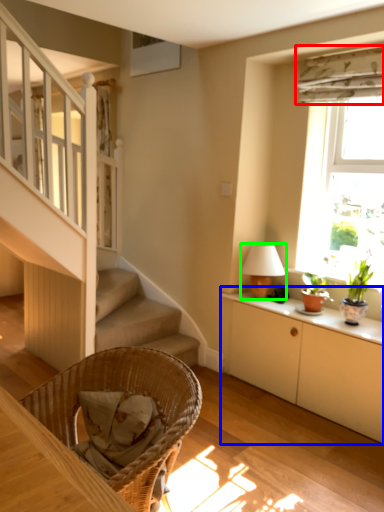
Question: Which object is the closest to the curtain (highlighted by a red box)? Choose among these: cabinetry (highlighted by a blue box) or table lamp (highlighted by a green box).

Choices:
 (A) cabinetry
 (B) table lamp

Answer: (B)